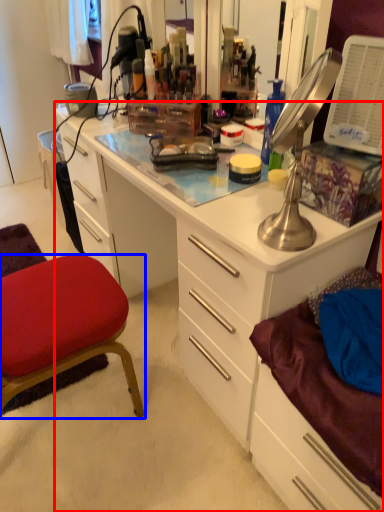
Question: Which object appears closest to the camera in this image, desk (highlighted by a red box) or chair (highlighted by a blue box)?

Choices:
 (A) desk
 (B) chair

Answer: (A)